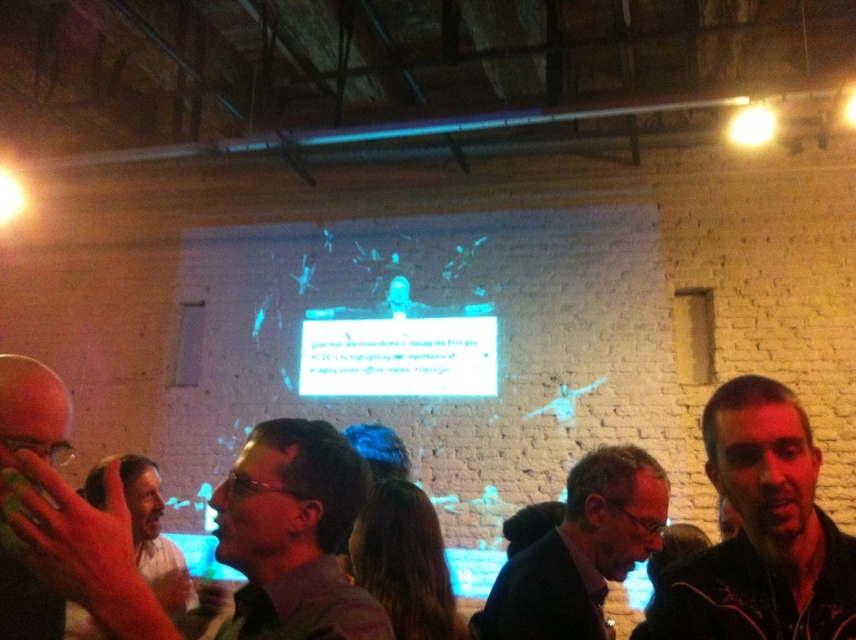
Question: Which of the following is the farthest from the observer?

Choices:
 (A) dark blue suit at center
 (B) matte black glasses at center
 (C) black fleece jacket at lower right
 (D) smooth leather jacket at lower left

Answer: (D)

Question: Does smooth skin hand at lower left appear on the left side of smooth leather jacket at lower left?

Choices:
 (A) no
 (B) yes

Answer: (A)

Question: Does dark blue suit at center lie in front of smooth skin hand at lower left?

Choices:
 (A) yes
 (B) no

Answer: (B)

Question: Among these points, which one is nearest to the camera?

Choices:
 (A) (13, 566)
 (B) (774, 461)
 (C) (103, 483)

Answer: (B)

Question: Can you confirm if smooth skin hand at lower left is positioned to the right of smooth leather jacket at lower left?

Choices:
 (A) yes
 (B) no

Answer: (A)

Question: Which of the following is the closest to the observer?

Choices:
 (A) black fleece jacket at lower right
 (B) smooth skin hand at lower left
 (C) dark blue suit at center

Answer: (B)